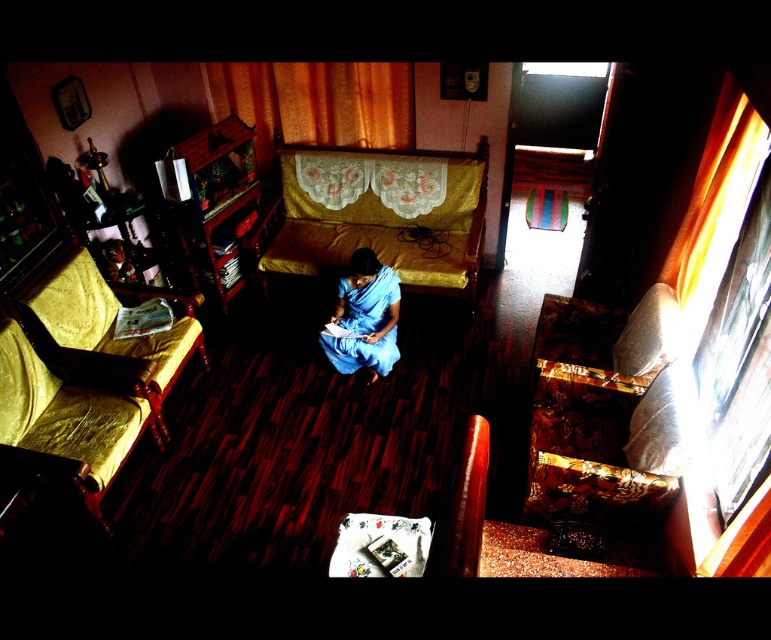
Which of these two, gold/yellow fabric couch at center or blue silk saree at center, stands shorter?

Standing shorter between the two is blue silk saree at center.

Is gold/yellow fabric couch at center to the left of blue silk saree at center from the viewer's perspective?

Incorrect, gold/yellow fabric couch at center is not on the left side of blue silk saree at center.

Is point (448, 195) more distant than point (325, 339)?

Yes.

Locate an element on the screen. This screenshot has width=771, height=640. gold/yellow fabric couch at center is located at coordinates (386, 228).

Is gold fabric couch at left shorter than blue silk saree at center?

In fact, gold fabric couch at left may be taller than blue silk saree at center.

From the picture: Is gold fabric couch at left positioned behind blue silk saree at center?

No.

What do you see at coordinates (86, 372) in the screenshot? I see `gold fabric couch at left` at bounding box center [86, 372].

Find the location of a particular element. Image resolution: width=771 pixels, height=640 pixels. gold fabric couch at left is located at coordinates (86, 372).

Is gold fabric couch at left taller than gold/yellow fabric couch at center?

Correct, gold fabric couch at left is much taller as gold/yellow fabric couch at center.

Is point (66, 298) closer to camera compared to point (480, 166)?

Yes, point (66, 298) is in front of point (480, 166).

Image resolution: width=771 pixels, height=640 pixels. What are the coordinates of `gold fabric couch at left` in the screenshot? It's located at (86, 372).

Where is `gold fabric couch at left`? Image resolution: width=771 pixels, height=640 pixels. gold fabric couch at left is located at coordinates (86, 372).